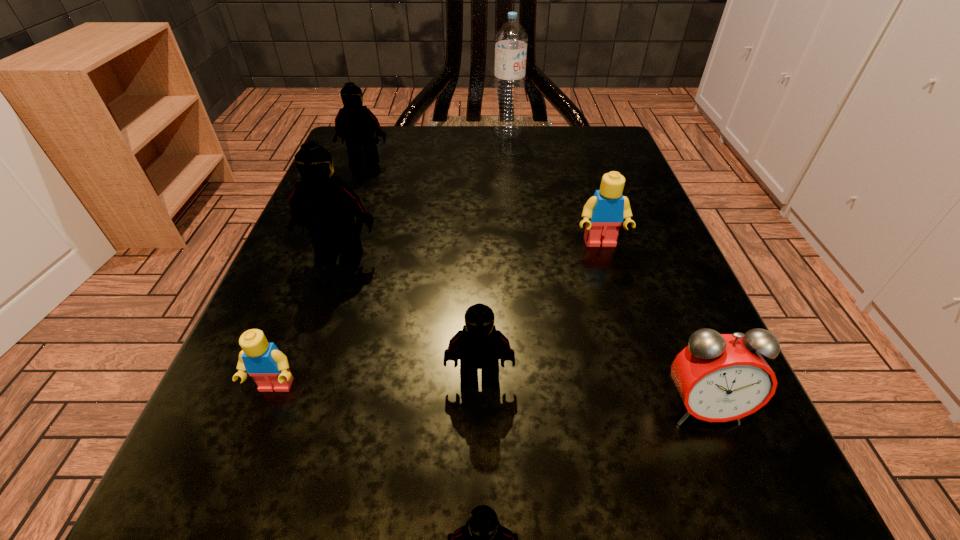
This screenshot has height=540, width=960. Find the location of `the tallest object`. the tallest object is located at coordinates (511, 40).

Identify the location of water bottle. (511, 40).

This screenshot has height=540, width=960. In order to click on the seventh shortest object in this screenshot , I will do `click(324, 204)`.

At what (x,y) coordinates should I click in order to perform the action: click on the tallest Lego. Please return your answer as a coordinate pair (x, y). The width and height of the screenshot is (960, 540). Looking at the image, I should click on (324, 204).

Find the location of `the second biggest black Lego`. the second biggest black Lego is located at coordinates (356, 124).

The width and height of the screenshot is (960, 540). I want to click on the sixth shortest object, so click(356, 124).

Locate an element on the screen. This screenshot has height=540, width=960. the farther yellow Lego is located at coordinates (604, 212).

The width and height of the screenshot is (960, 540). I want to click on the rightmost Lego, so click(604, 212).

At what (x,y) coordinates should I click in order to perform the action: click on the second nearest black Lego. Please return your answer as a coordinate pair (x, y). Looking at the image, I should click on (479, 345).

This screenshot has height=540, width=960. I want to click on alarm clock, so click(720, 377).